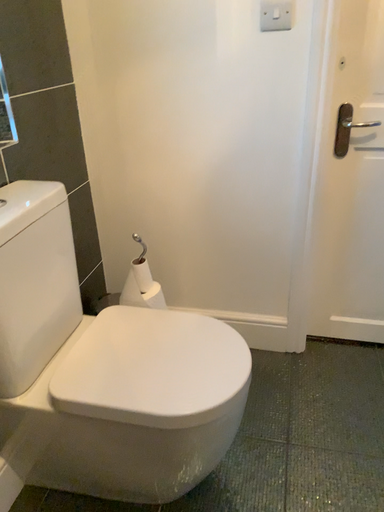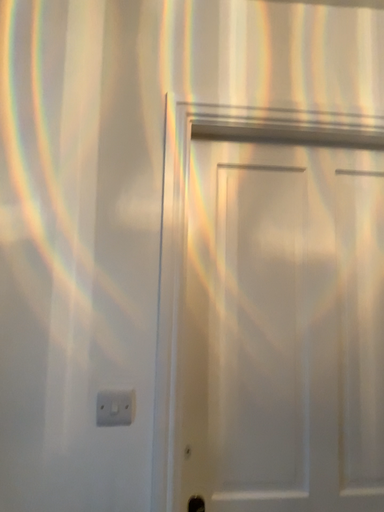
Question: How did the camera likely rotate when shooting the video?

Choices:
 (A) rotated right
 (B) rotated left

Answer: (A)